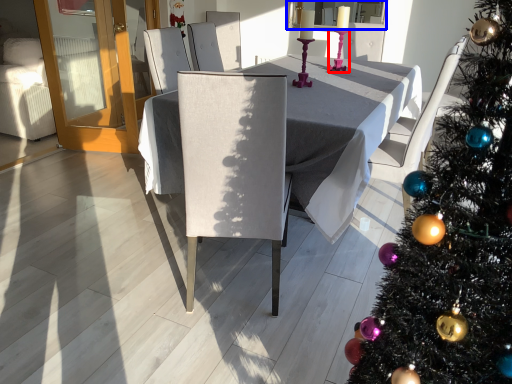
Question: Which object is closer to the camera taking this photo, candle holder (highlighted by a red box) or window screen (highlighted by a blue box)?

Choices:
 (A) candle holder
 (B) window screen

Answer: (A)